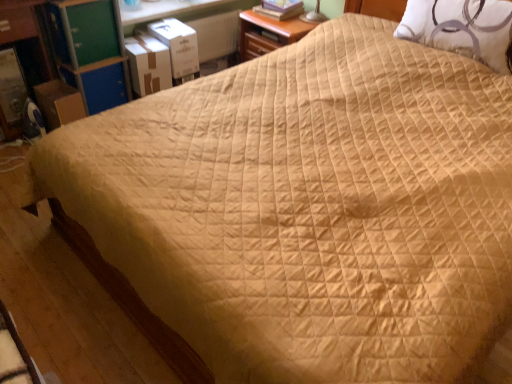
Question: Is green plastic dresser at upper left, which is the first dresser in right-to-left order, far from white quilted pillow at upper right?

Choices:
 (A) no
 (B) yes

Answer: (B)

Question: Is white quilted pillow at upper right inside green plastic dresser at upper left, which is the first dresser in right-to-left order?

Choices:
 (A) yes
 (B) no

Answer: (B)

Question: Does green plastic dresser at upper left, which is the first dresser in right-to-left order, appear on the left side of white quilted pillow at upper right?

Choices:
 (A) no
 (B) yes

Answer: (B)

Question: Does green plastic dresser at upper left, placed as the second dresser when sorted from left to right, have a greater width compared to white quilted pillow at upper right?

Choices:
 (A) yes
 (B) no

Answer: (A)

Question: Is green plastic dresser at upper left, which is the first dresser in right-to-left order, in contact with white quilted pillow at upper right?

Choices:
 (A) no
 (B) yes

Answer: (A)

Question: Is green plastic dresser at upper left, which is the first dresser in right-to-left order, taller than white quilted pillow at upper right?

Choices:
 (A) no
 (B) yes

Answer: (B)

Question: Are white quilted pillow at upper right and hardcover book at upper center beside each other?

Choices:
 (A) yes
 (B) no

Answer: (B)

Question: From a real-world perspective, is white quilted pillow at upper right on top of hardcover book at upper center?

Choices:
 (A) no
 (B) yes

Answer: (B)

Question: Is white quilted pillow at upper right not close to hardcover book at upper center?

Choices:
 (A) no
 (B) yes

Answer: (A)

Question: Is white quilted pillow at upper right positioned with its back to hardcover book at upper center?

Choices:
 (A) yes
 (B) no

Answer: (B)

Question: Is white quilted pillow at upper right taller than hardcover book at upper center?

Choices:
 (A) no
 (B) yes

Answer: (B)

Question: From the image's perspective, would you say white quilted pillow at upper right is shown under hardcover book at upper center?

Choices:
 (A) no
 (B) yes

Answer: (B)

Question: Is white cardboard box at upper left, which ranks as the second cardboard box in left-to-right order, far away from hardcover book at upper center?

Choices:
 (A) no
 (B) yes

Answer: (A)